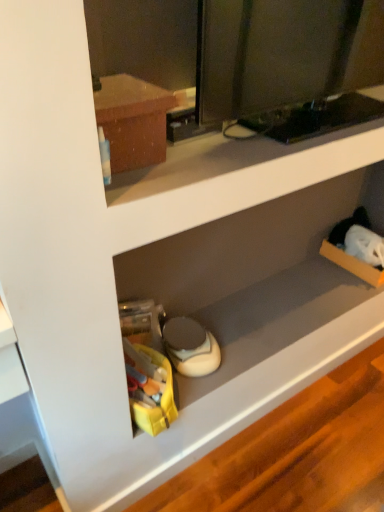
What is the approximate height of white matte speaker at lower center?

Result: white matte speaker at lower center is 0.76 inches in height.

Where is `white matte speaker at lower center`? The image size is (384, 512). white matte speaker at lower center is located at coordinates (256, 274).

Measure the distance between white matte speaker at lower center and camera.

The depth of white matte speaker at lower center is 4.04 feet.

The image size is (384, 512). Describe the element at coordinates (256, 274) in the screenshot. I see `white matte speaker at lower center` at that location.

The width and height of the screenshot is (384, 512). Describe the element at coordinates (133, 121) in the screenshot. I see `matte brown cabinet at upper left` at that location.

What is the approximate height of matte brown cabinet at upper left?

It is 5.58 inches.

You are a GUI agent. You are given a task and a screenshot of the screen. Output one action in this format:
    pyautogui.click(x=<x>, y=<y>)
    Task: Click on the matte brown cabinet at upper left
    
    Given the screenshot: What is the action you would take?
    pyautogui.click(x=133, y=121)

Measure the distance between matte brown cabinet at upper left and camera.

A distance of 28.88 inches exists between matte brown cabinet at upper left and camera.

The image size is (384, 512). In order to click on white matte speaker at lower center in this screenshot , I will do `click(256, 274)`.

Considering the positions of objects white matte speaker at lower center and matte brown cabinet at upper left in the image provided, who is more to the left, white matte speaker at lower center or matte brown cabinet at upper left?

matte brown cabinet at upper left is more to the left.

Which is in front, white matte speaker at lower center or matte brown cabinet at upper left?

matte brown cabinet at upper left is more forward.

Is point (294, 291) closer or farther from the camera than point (139, 157)?

Point (294, 291).

From the image's perspective, is white matte speaker at lower center on matte brown cabinet at upper left?

Incorrect, from the image's perspective, white matte speaker at lower center is lower than matte brown cabinet at upper left.

From a real-world perspective, which object stands above the other?

→ In real-world perspective, matte brown cabinet at upper left is above.

Which object is wider, white matte speaker at lower center or matte brown cabinet at upper left?

With larger width is white matte speaker at lower center.

Is white matte speaker at lower center taller than matte brown cabinet at upper left?

Incorrect, the height of white matte speaker at lower center is not larger of that of matte brown cabinet at upper left.

Can you confirm if white matte speaker at lower center is smaller than matte brown cabinet at upper left?

No, white matte speaker at lower center is not smaller than matte brown cabinet at upper left.

Is white matte speaker at lower center situated inside matte brown cabinet at upper left or outside?

white matte speaker at lower center is not inside matte brown cabinet at upper left, it's outside.

Is white matte speaker at lower center touching matte brown cabinet at upper left?

No, white matte speaker at lower center is not touching matte brown cabinet at upper left.

Is matte brown cabinet at upper left at the back of white matte speaker at lower center?

No, white matte speaker at lower center's orientation is not away from matte brown cabinet at upper left.

What's the angular difference between white matte speaker at lower center and matte brown cabinet at upper left's facing directions?

They differ by 0.000767 degrees in their facing directions.

Where is `shelf below the matte brown cabinet at upper left (from a real-world perspective)`? Image resolution: width=384 pixels, height=512 pixels. shelf below the matte brown cabinet at upper left (from a real-world perspective) is located at coordinates (256, 274).

Considering the relative positions of matte brown cabinet at upper left and white matte speaker at lower center in the image provided, is matte brown cabinet at upper left to the left of white matte speaker at lower center from the viewer's perspective?

Yes, matte brown cabinet at upper left is to the left of white matte speaker at lower center.

Who is more distant, matte brown cabinet at upper left or white matte speaker at lower center?

white matte speaker at lower center is behind.

Considering the points (164, 106) and (135, 267), which point is behind, point (164, 106) or point (135, 267)?

The point (135, 267) is behind.

From the image's perspective, who appears lower, matte brown cabinet at upper left or white matte speaker at lower center?

white matte speaker at lower center appears lower in the image.

From a real-world perspective, is matte brown cabinet at upper left below white matte speaker at lower center?

No.

Does matte brown cabinet at upper left have a greater width compared to white matte speaker at lower center?

No.

Can you confirm if matte brown cabinet at upper left is shorter than white matte speaker at lower center?

Incorrect, the height of matte brown cabinet at upper left does not fall short of that of white matte speaker at lower center.

Considering the sizes of objects matte brown cabinet at upper left and white matte speaker at lower center in the image provided, who is smaller, matte brown cabinet at upper left or white matte speaker at lower center?

Smaller between the two is matte brown cabinet at upper left.

In the scene shown: Is white matte speaker at lower center inside matte brown cabinet at upper left?

No.

Is matte brown cabinet at upper left far from white matte speaker at lower center?

matte brown cabinet at upper left is near white matte speaker at lower center, not far away.

Consider the image. Is matte brown cabinet at upper left facing away from white matte speaker at lower center?

No.

How different are the orientations of matte brown cabinet at upper left and white matte speaker at lower center in degrees?

matte brown cabinet at upper left and white matte speaker at lower center are facing 0.000767 degrees away from each other.

You are a GUI agent. You are given a task and a screenshot of the screen. Output one action in this format:
    pyautogui.click(x=<x>, y=<y>)
    Task: Click on the shelf behind the matte brown cabinet at upper left
    The height and width of the screenshot is (512, 384).
    Given the screenshot: What is the action you would take?
    pyautogui.click(x=256, y=274)

This screenshot has height=512, width=384. Find the location of `cabinetry on the left of white matte speaker at lower center`. cabinetry on the left of white matte speaker at lower center is located at coordinates (133, 121).

You are a GUI agent. You are given a task and a screenshot of the screen. Output one action in this format:
    pyautogui.click(x=<x>, y=<y>)
    Task: Click on the cabinetry in front of the white matte speaker at lower center
    
    Given the screenshot: What is the action you would take?
    pyautogui.click(x=133, y=121)